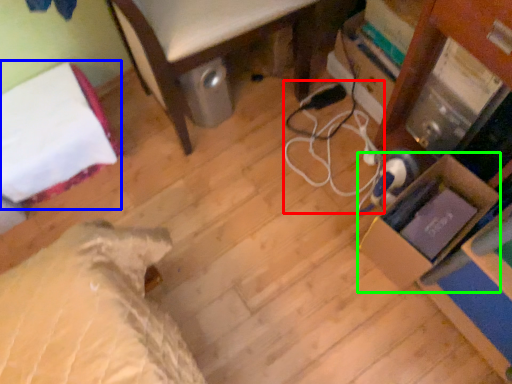
Question: Considering the real-world distances, which object is farthest from cable (highlighted by a red box)? bed (highlighted by a blue box) or cardboard box (highlighted by a green box)?

Choices:
 (A) bed
 (B) cardboard box

Answer: (A)